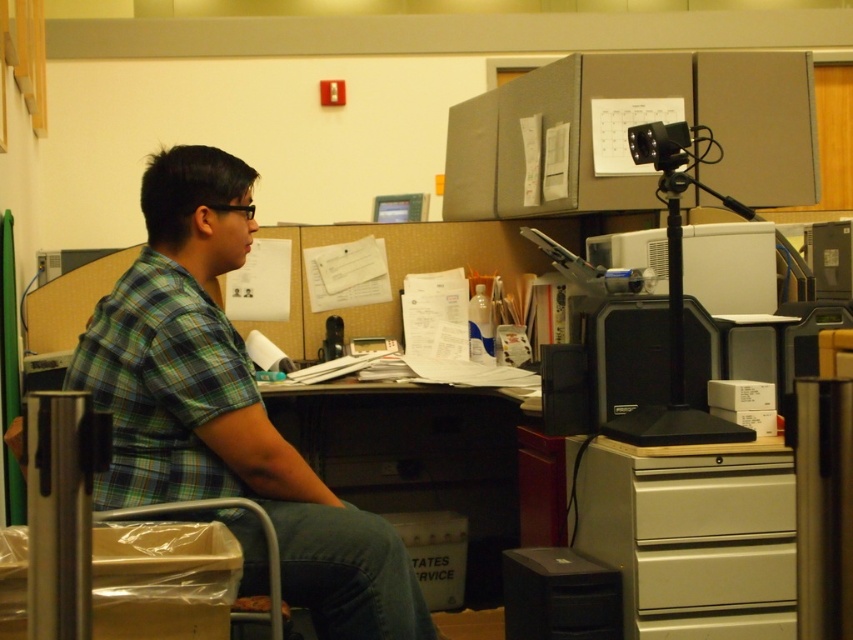
Question: Which object is the farthest from the metallic gray drawer at lower center?

Choices:
 (A) metallic gray swivel chair at left
 (B) green plaid shirt at left

Answer: (A)

Question: Which point is closer to the camera?

Choices:
 (A) (216, 513)
 (B) (653, 580)

Answer: (A)

Question: In this image, where is dark brown wood desk at center located relative to metallic gray drawer at lower center?

Choices:
 (A) above
 (B) below

Answer: (A)

Question: Which of these objects is positioned farthest from the metallic gray swivel chair at left?

Choices:
 (A) beige plastic drawer at lower right
 (B) metallic gray drawer at lower center

Answer: (A)

Question: Is green plaid shirt at left further to camera compared to dark brown wood desk at center?

Choices:
 (A) yes
 (B) no

Answer: (B)

Question: Does dark brown wood desk at center have a lesser width compared to metallic gray drawer at lower center?

Choices:
 (A) yes
 (B) no

Answer: (B)